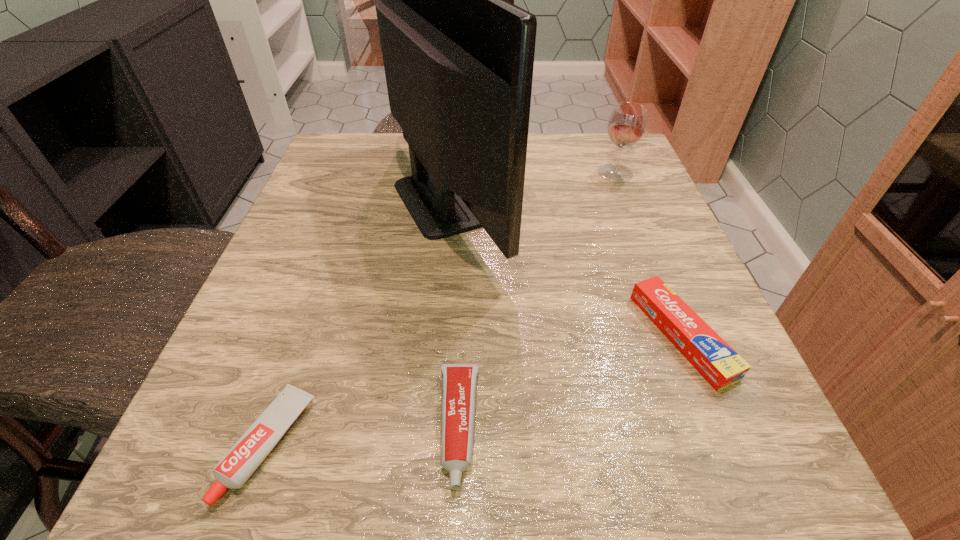
The height and width of the screenshot is (540, 960). In order to click on wineglass that is at the far edge in this screenshot , I will do `click(627, 123)`.

Where is `object that is at the left edge`? object that is at the left edge is located at coordinates (235, 468).

I want to click on wineglass present at the right edge, so click(x=627, y=123).

Image resolution: width=960 pixels, height=540 pixels. Identify the location of toothpaste positioned at the right edge. (720, 365).

Locate an element on the screen. object that is at the near left corner is located at coordinates (235, 468).

Locate an element on the screen. The height and width of the screenshot is (540, 960). object that is positioned at the far right corner is located at coordinates (627, 123).

The width and height of the screenshot is (960, 540). What are the coordinates of `vacant area at the far edge` in the screenshot? It's located at (541, 169).

The height and width of the screenshot is (540, 960). In the image, there is a desktop. What are the coordinates of `vacant space at the near edge` in the screenshot? It's located at (517, 474).

The width and height of the screenshot is (960, 540). What are the coordinates of `vacant space at the left edge of the desktop` in the screenshot? It's located at (271, 315).

Identify the location of free point at the right edge. The height and width of the screenshot is (540, 960). (607, 284).